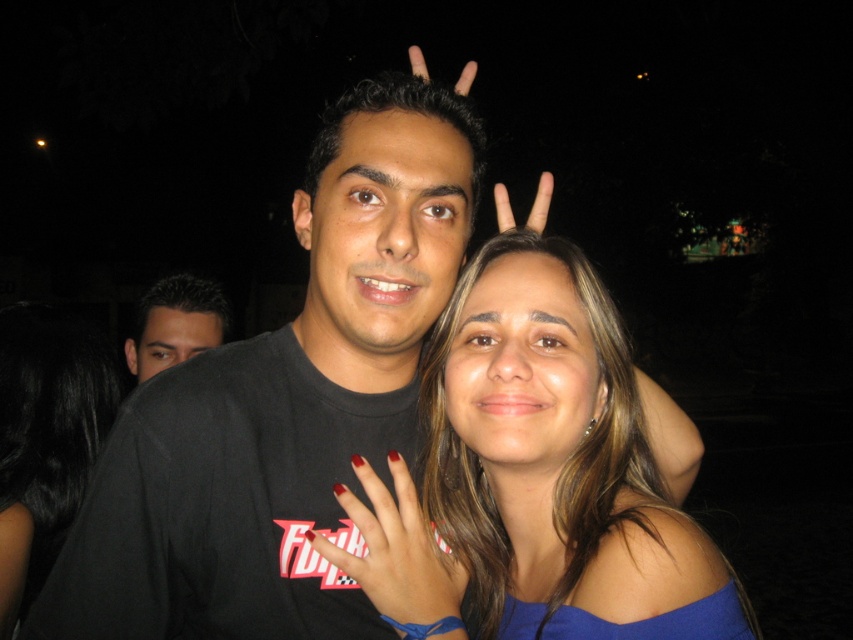
Question: Where is smooth blue top at center located in relation to black matte shirt at left in the image?

Choices:
 (A) right
 (B) left

Answer: (A)

Question: Which object is closer to the camera taking this photo?

Choices:
 (A) nail polish at center
 (B) matte black hand at upper center

Answer: (A)

Question: Can you confirm if smooth blue top at center is wider than matte black hand at upper center?

Choices:
 (A) yes
 (B) no

Answer: (B)

Question: Does nail polish at center lie in front of black matte shirt at left?

Choices:
 (A) no
 (B) yes

Answer: (B)

Question: Which object is farther from the camera taking this photo?

Choices:
 (A) smooth blue top at center
 (B) black matte shirt at left
 (C) matte black hand at upper center
 (D) nail polish at center

Answer: (C)

Question: Which point is closer to the camera?

Choices:
 (A) (177, 332)
 (B) (477, 268)
 (C) (421, 515)
 (D) (412, 58)

Answer: (C)